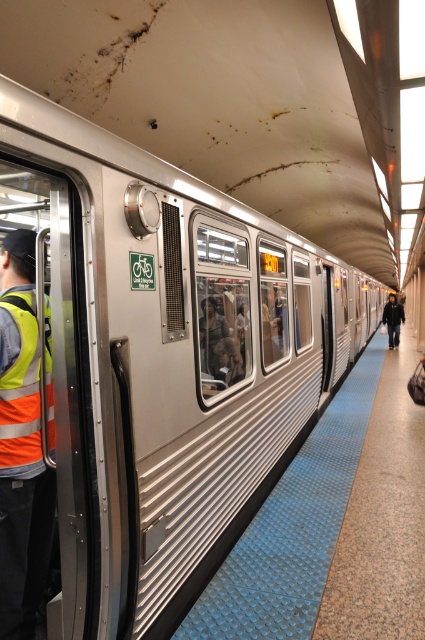
Which is behind, point (23, 433) or point (391, 310)?

Positioned behind is point (391, 310).

What do you see at coordinates (20, 387) in the screenshot? I see `high-visibility fabric safety vest at left` at bounding box center [20, 387].

Locate an element on the screen. high-visibility fabric safety vest at left is located at coordinates (20, 387).